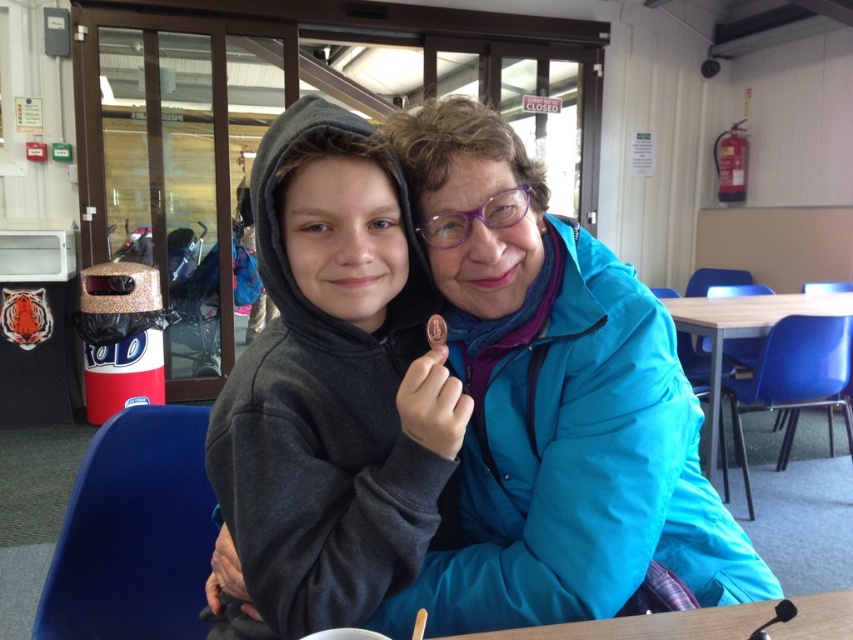
How far apart are wooden table at lower center and wooden table at center?

7.91 feet

Looking at this image, between wooden table at lower center and wooden table at center, which one is positioned higher?

wooden table at center is higher up.

Identify the location of wooden table at lower center. (650, 625).

At what (x,y) coordinates should I click in order to perform the action: click on wooden table at lower center. Please return your answer as a coordinate pair (x, y). The height and width of the screenshot is (640, 853). Looking at the image, I should click on (650, 625).

Which is above, blue fuzzy jacket at center or wooden table at center?

wooden table at center is higher up.

Is point (657, 326) more distant than point (717, 381)?

No, it is not.

Is point (434, 282) positioned before point (712, 358)?

That is True.

This screenshot has width=853, height=640. Find the location of `blue fuzzy jacket at center`. blue fuzzy jacket at center is located at coordinates (552, 404).

Which is more to the right, blue fuzzy jacket at center or matte gray hoodie at center?

Positioned to the right is blue fuzzy jacket at center.

Between point (576, 474) and point (268, 250), which one is positioned behind?

The point (576, 474) is behind.

Is point (666, 448) behind point (323, 113)?

Yes, it is behind point (323, 113).

Identify the location of blue fuzzy jacket at center. This screenshot has width=853, height=640. pyautogui.click(x=552, y=404).